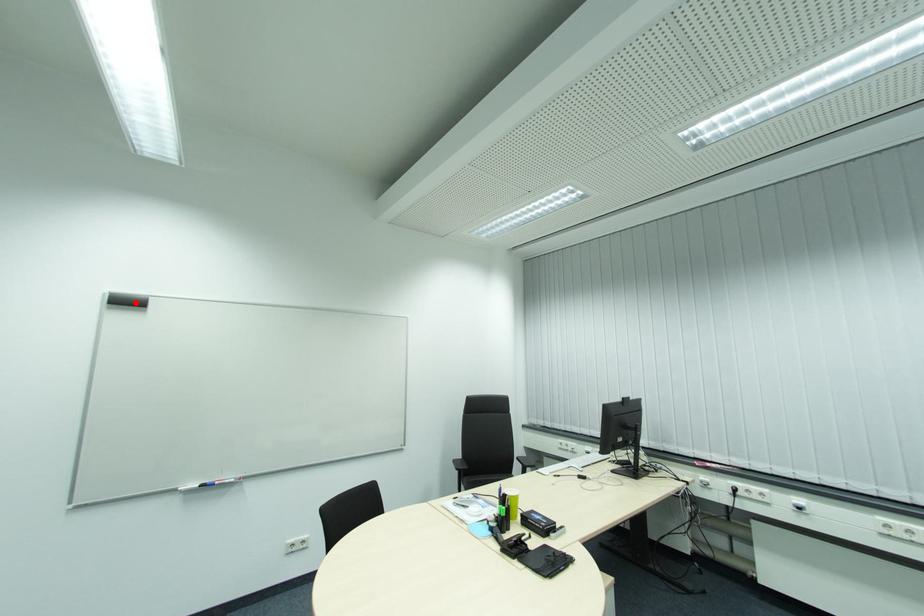
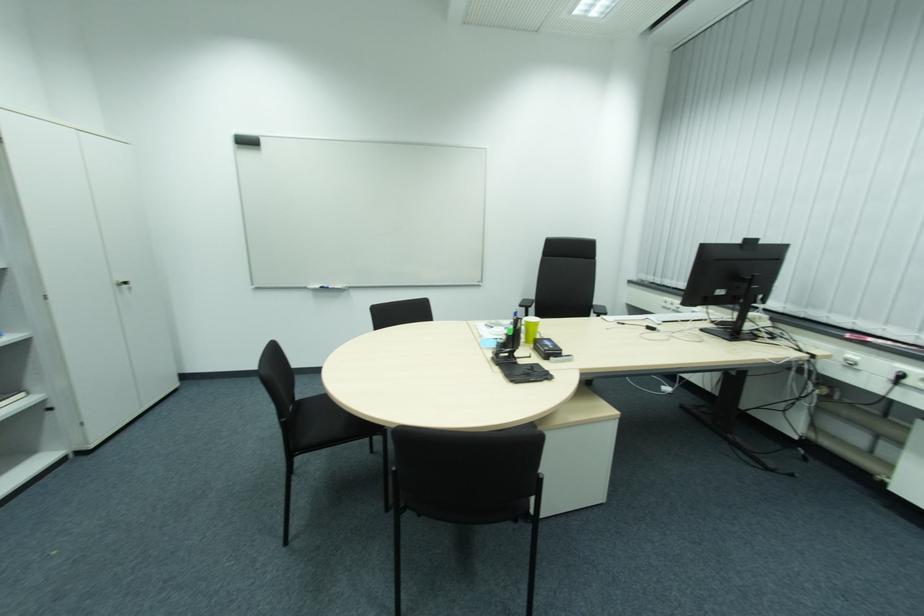
Locate, in the second image, the point that corresponds to the highlighted location in the first image.

(252, 144)